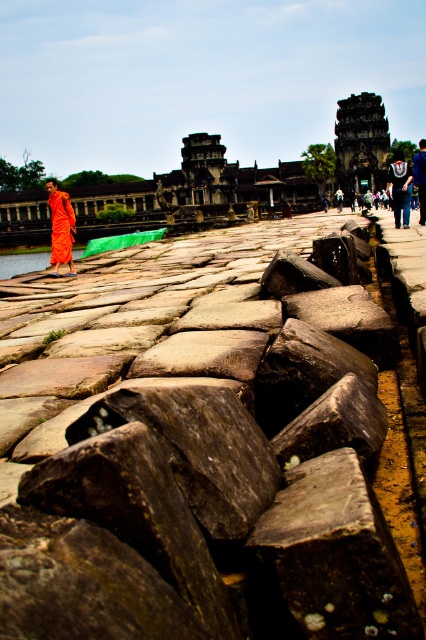
At what (x,y) coordinates should I click in order to perform the action: click on orange cloth monk at center. Please return your answer as a coordinate pair (x, y). Looking at the image, I should click on (400, 188).

Does orange cloth monk at center have a lesser height compared to orange cloth monk at left?

No, orange cloth monk at center is not shorter than orange cloth monk at left.

This screenshot has width=426, height=640. I want to click on orange cloth monk at center, so click(x=400, y=188).

Is point (60, 324) behind point (400, 195)?

That is False.

Is point (190, 636) closer to camera compared to point (406, 211)?

Yes, it is in front of point (406, 211).

Locate an element on the screen. The width and height of the screenshot is (426, 640). brown rough stone at left is located at coordinates (193, 451).

Is brown rough stone at left to the left of orange cloth monk at left from the viewer's perspective?

Indeed, brown rough stone at left is positioned on the left side of orange cloth monk at left.

Does brown rough stone at left appear over orange cloth monk at left?

Actually, brown rough stone at left is below orange cloth monk at left.

Find the location of `brown rough stone at left`. brown rough stone at left is located at coordinates (193, 451).

This screenshot has width=426, height=640. I want to click on brown rough stone at left, so click(193, 451).